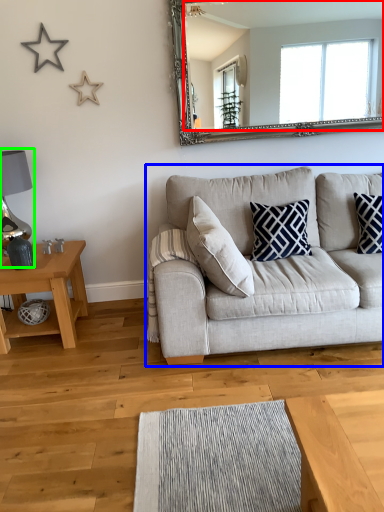
Question: Which object is positioned farthest from mirror (highlighted by a red box)? Select from studio couch (highlighted by a blue box) and lamp (highlighted by a green box).

Choices:
 (A) studio couch
 (B) lamp

Answer: (B)